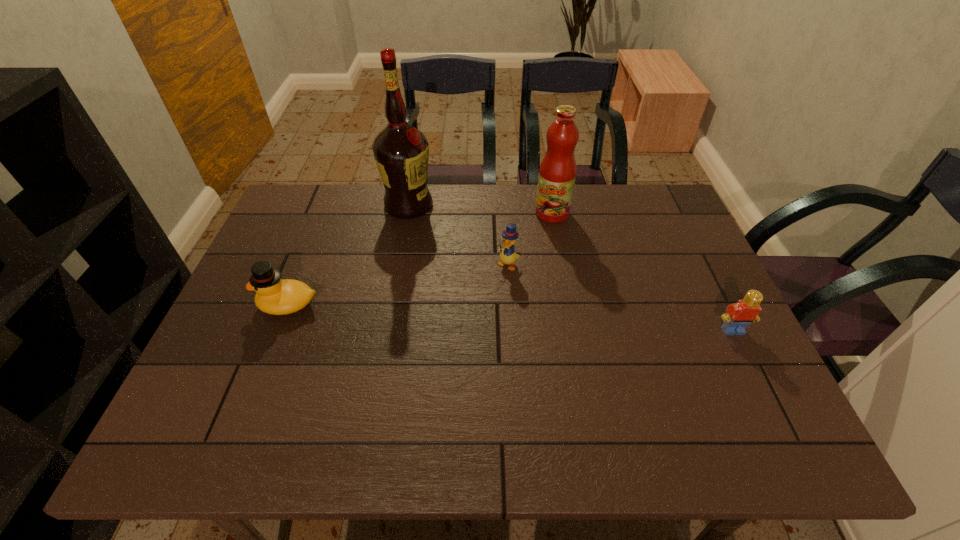
What are the coordinates of `free location located on the front-facing side of the rightmost object` in the screenshot? It's located at (769, 404).

In order to click on vacant space located 0.240m on the label of the tallest object in this screenshot , I will do `click(452, 267)`.

Where is `vacant area located 0.370m on the label of the tallest object`? The height and width of the screenshot is (540, 960). vacant area located 0.370m on the label of the tallest object is located at coordinates (473, 298).

Find the location of a particular element. free location located on the label of the tallest object is located at coordinates (467, 287).

Where is `free space located 0.120m on the front label of the second object from right to left`? The width and height of the screenshot is (960, 540). free space located 0.120m on the front label of the second object from right to left is located at coordinates (532, 246).

Where is `free space located 0.330m on the front label of the second object from right to left`? free space located 0.330m on the front label of the second object from right to left is located at coordinates (502, 294).

Locate an element on the screen. This screenshot has height=540, width=960. free space located on the front label of the second object from right to left is located at coordinates (515, 274).

Where is `vacant space situated 0.400m on the face of the third object from left to right, where the monocle is placed`? This screenshot has height=540, width=960. vacant space situated 0.400m on the face of the third object from left to right, where the monocle is placed is located at coordinates point(411,377).

Where is `free space located on the face of the third object from left to right, where the monocle is placed`? The height and width of the screenshot is (540, 960). free space located on the face of the third object from left to right, where the monocle is placed is located at coordinates (422, 364).

Identify the location of vacant area situated 0.360m on the face of the third object from left to right, where the monocle is placed. (422, 364).